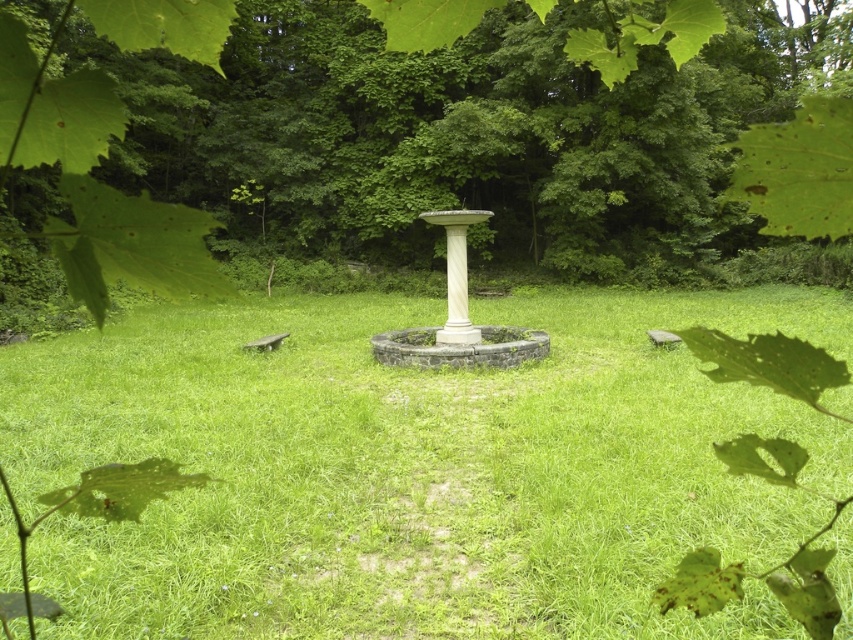
Question: Which of the following is the closest to the observer?

Choices:
 (A) green grassy at center
 (B) green leafy tree at center

Answer: (B)

Question: Can you confirm if green grassy at center is positioned below green leafy tree at center?

Choices:
 (A) no
 (B) yes

Answer: (B)

Question: Observing the image, what is the correct spatial positioning of green grassy at center in reference to green leafy tree at center?

Choices:
 (A) above
 (B) below

Answer: (B)

Question: Is green grassy at center to the right of green leafy tree at center from the viewer's perspective?

Choices:
 (A) yes
 (B) no

Answer: (B)

Question: Which point is farther from the camera taking this photo?

Choices:
 (A) (490, 589)
 (B) (753, 36)

Answer: (B)